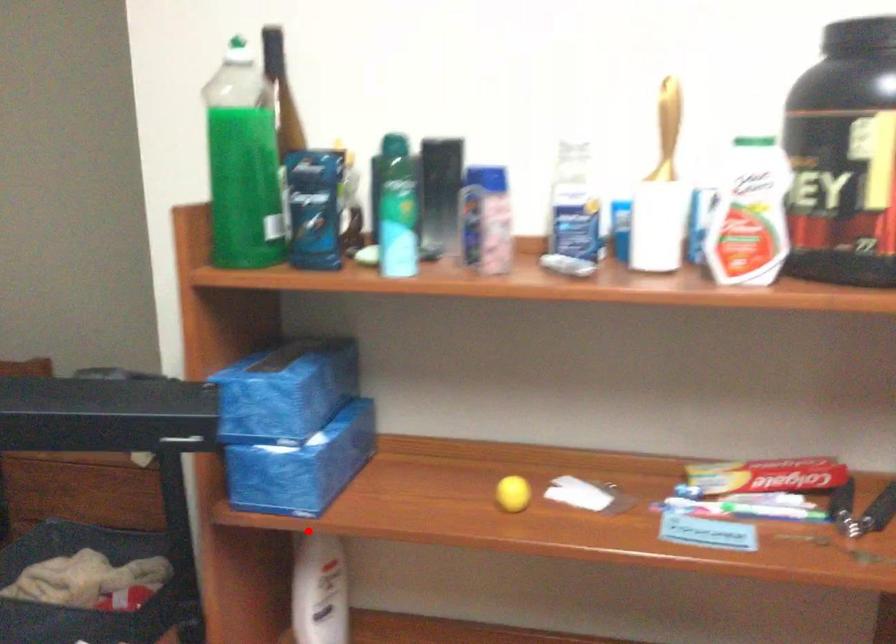
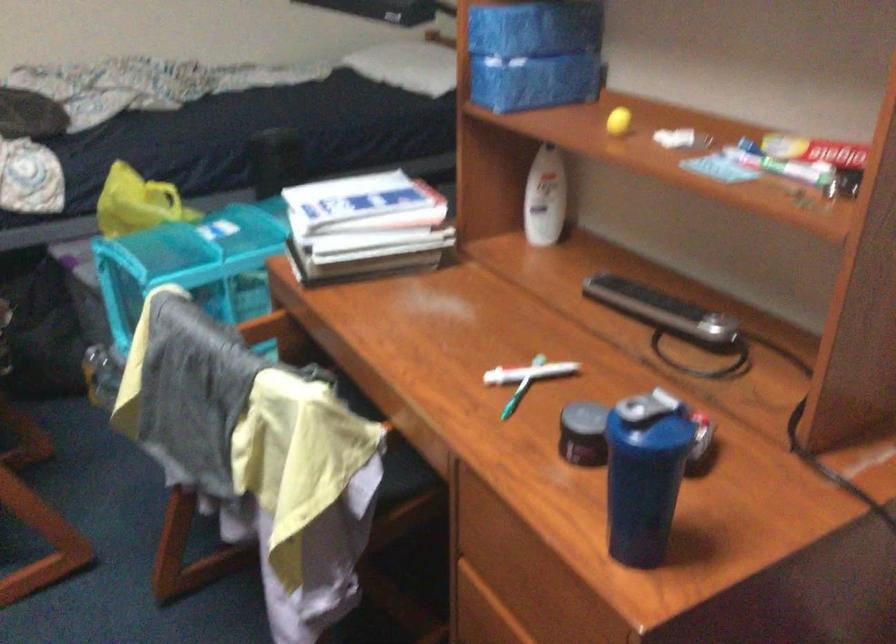
Find the pixel in the second image that matches the highlighted location in the first image.

(541, 147)